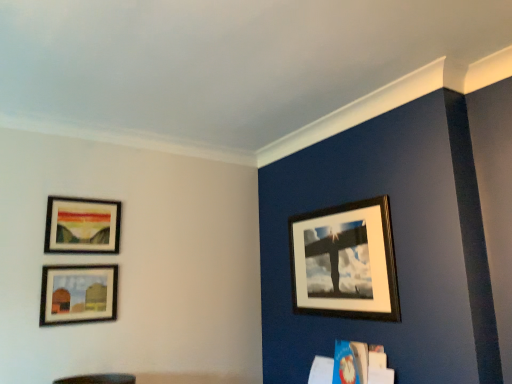
Question: Considering the relative positions of matte wooden picture frame at upper left, the 1th picture frame viewed from the left, and matte wooden picture frame at lower left, the 2th picture frame viewed from the left, in the image provided, is matte wooden picture frame at upper left, the 1th picture frame viewed from the left, in front of matte wooden picture frame at lower left, the 2th picture frame viewed from the left,?

Choices:
 (A) no
 (B) yes

Answer: (A)

Question: Could you tell me if matte wooden picture frame at upper left, the 3th picture frame in the right-to-left sequence, is turned towards matte wooden picture frame at lower left, the second picture frame in the right-to-left sequence?

Choices:
 (A) no
 (B) yes

Answer: (A)

Question: From the image's perspective, is matte wooden picture frame at upper left, the 1th picture frame viewed from the left, above matte wooden picture frame at lower left, the 2th picture frame viewed from the left?

Choices:
 (A) no
 (B) yes

Answer: (B)

Question: Is matte wooden picture frame at upper left, the 3th picture frame in the right-to-left sequence, in contact with matte wooden picture frame at lower left, the second picture frame in the right-to-left sequence?

Choices:
 (A) yes
 (B) no

Answer: (B)

Question: Is matte wooden picture frame at upper left, the 1th picture frame viewed from the left, shorter than matte wooden picture frame at lower left, the 2th picture frame viewed from the left?

Choices:
 (A) yes
 (B) no

Answer: (B)

Question: Considering the positions of wooden picture frame at upper right, the 3th picture frame viewed from the left, and matte wooden picture frame at lower left, the second picture frame in the right-to-left sequence, in the image, is wooden picture frame at upper right, the 3th picture frame viewed from the left, taller or shorter than matte wooden picture frame at lower left, the second picture frame in the right-to-left sequence,?

Choices:
 (A) tall
 (B) short

Answer: (A)

Question: From a real-world perspective, is wooden picture frame at upper right, the 3th picture frame viewed from the left, physically located above or below matte wooden picture frame at lower left, the second picture frame in the right-to-left sequence?

Choices:
 (A) below
 (B) above

Answer: (B)

Question: Do you think wooden picture frame at upper right, the 3th picture frame viewed from the left, is within matte wooden picture frame at lower left, the 2th picture frame viewed from the left, or outside of it?

Choices:
 (A) inside
 (B) outside

Answer: (B)

Question: In terms of width, does wooden picture frame at upper right, the 1th picture frame positioned from the right, look wider or thinner when compared to matte wooden picture frame at lower left, the 2th picture frame viewed from the left?

Choices:
 (A) thin
 (B) wide

Answer: (B)

Question: From the image's perspective, relative to wooden picture frame at upper right, the 1th picture frame positioned from the right, is matte wooden picture frame at lower left, the second picture frame in the right-to-left sequence, above or below?

Choices:
 (A) below
 (B) above

Answer: (A)

Question: Is matte wooden picture frame at lower left, the second picture frame in the right-to-left sequence, bigger or smaller than wooden picture frame at upper right, the 3th picture frame viewed from the left?

Choices:
 (A) small
 (B) big

Answer: (A)

Question: From a real-world perspective, relative to wooden picture frame at upper right, the 3th picture frame viewed from the left, is matte wooden picture frame at lower left, the second picture frame in the right-to-left sequence, vertically above or below?

Choices:
 (A) below
 (B) above

Answer: (A)

Question: Is point (84, 269) closer or farther from the camera than point (381, 243)?

Choices:
 (A) farther
 (B) closer

Answer: (A)

Question: Looking at their shapes, would you say matte wooden picture frame at upper left, the 3th picture frame in the right-to-left sequence, is wider or thinner than matte wooden picture frame at lower left, the 2th picture frame viewed from the left?

Choices:
 (A) wide
 (B) thin

Answer: (A)

Question: In the image, is matte wooden picture frame at upper left, the 1th picture frame viewed from the left, on the left side or the right side of matte wooden picture frame at lower left, the second picture frame in the right-to-left sequence?

Choices:
 (A) left
 (B) right

Answer: (A)